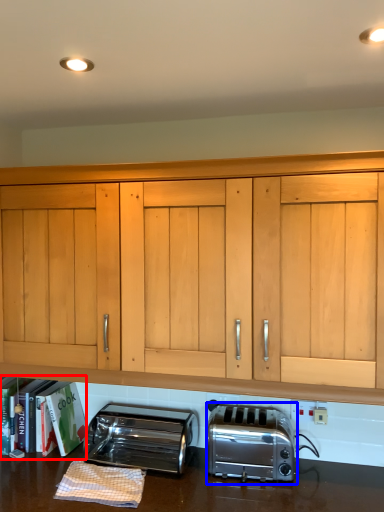
Question: Which of the following is the farthest to the observer, bookshelf (highlighted by a red box) or toaster (highlighted by a blue box)?

Choices:
 (A) bookshelf
 (B) toaster

Answer: (A)